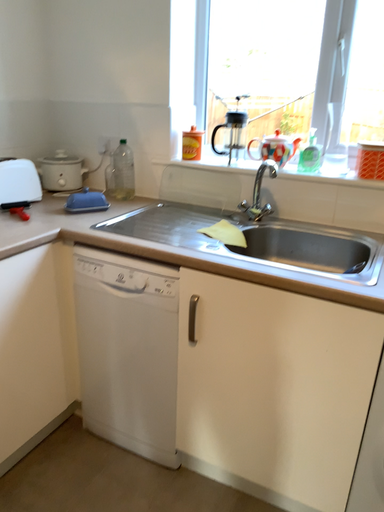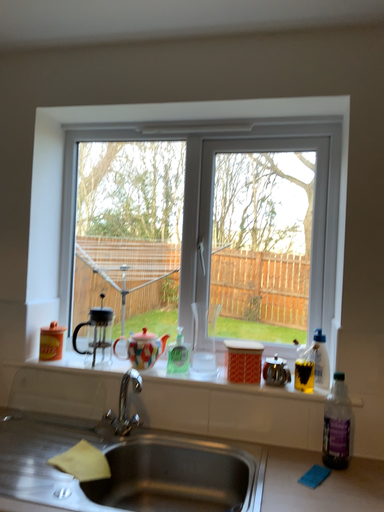
Question: How did the camera likely rotate when shooting the video?

Choices:
 (A) rotated left
 (B) rotated right

Answer: (B)